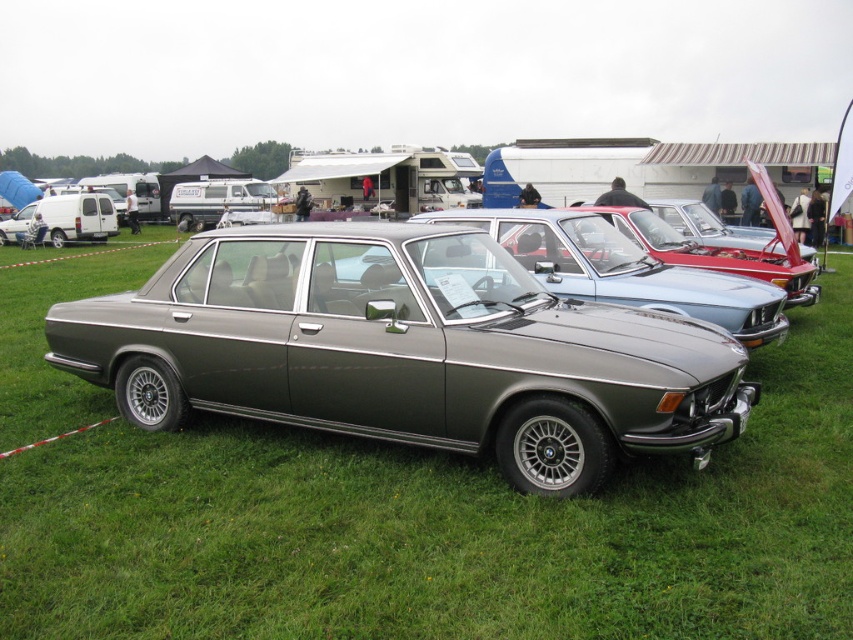
You are a photographer wanting to capture both the satin metallic car at center and the metallic gray sedan at center in a single frame. Based on their positions, which car should you position closer to the left side of your camera viewfinder?

The satin metallic car at center is to the left of the metallic gray sedan at center, so you should position the satin metallic car at center closer to the left side of your camera viewfinder to include both in the frame.

Looking at this image, you are standing at the center of the grassy field and see the point marked at coordinates point (405, 349). What object is located at that point?

The point (405, 349) indicates the location of the satin metallic car at center.

You are a photographer positioned at point 0.0, 0.0 and want to capture the satin metallic car at center in your shot. What are the coordinates of the car you need to aim for?

The satin metallic car at center is located at coordinates (405,349).